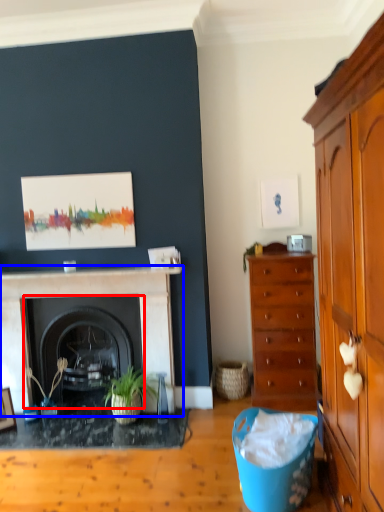
Question: Among these objects, which one is nearest to the camera, fireplace (highlighted by a red box) or fireplace (highlighted by a blue box)?

Choices:
 (A) fireplace
 (B) fireplace

Answer: (B)